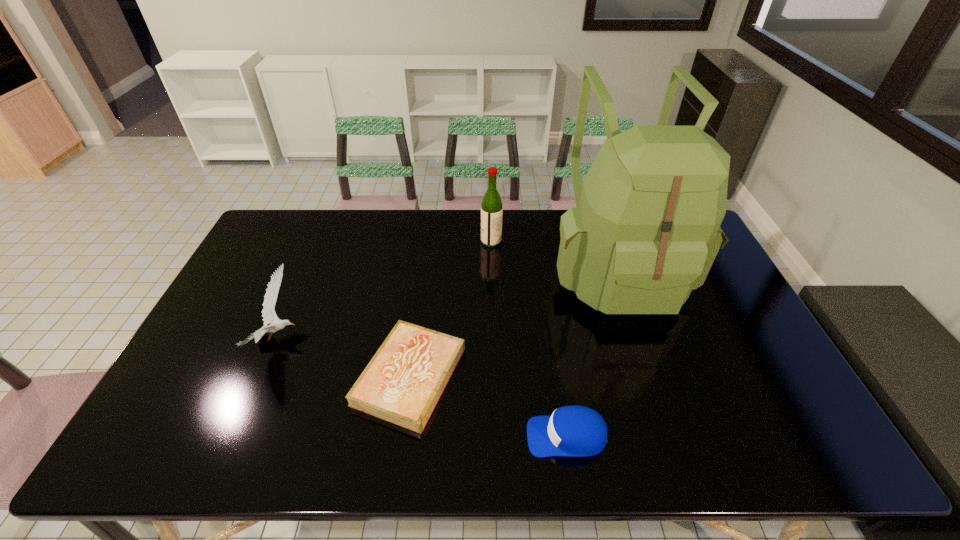
Identify the location of free region located 0.380m on the label of the liquor. The width and height of the screenshot is (960, 540). (374, 241).

Where is `free space located 0.330m on the label of the liquor`? Image resolution: width=960 pixels, height=540 pixels. free space located 0.330m on the label of the liquor is located at coordinates (389, 241).

The width and height of the screenshot is (960, 540). What are the coordinates of `free space located at the tip of the beak of the leftmost object` in the screenshot? It's located at (357, 339).

At what (x,y) coordinates should I click in order to perform the action: click on vacant point located on the front-facing side of the second shortest object. Please return your answer as a coordinate pair (x, y). This screenshot has width=960, height=540. Looking at the image, I should click on (387, 436).

You are a GUI agent. You are given a task and a screenshot of the screen. Output one action in this format:
    pyautogui.click(x=<x>, y=<y>)
    Task: Click on the vacant region located on the front-facing side of the second shortest object
    
    Given the screenshot: What is the action you would take?
    pos(361,436)

This screenshot has height=540, width=960. I want to click on blank space located 0.280m on the front-facing side of the second shortest object, so click(x=408, y=436).

Identify the location of vacant space situated on the left of the fourth object from right to left. (318, 376).

The width and height of the screenshot is (960, 540). What are the coordinates of `backpack present at the far edge` in the screenshot? It's located at (645, 232).

At what (x,y) coordinates should I click in order to perform the action: click on liquor that is at the far edge. Please return your answer as a coordinate pair (x, y). This screenshot has width=960, height=540. Looking at the image, I should click on (491, 206).

Locate an element on the screen. baseball cap located at the near edge is located at coordinates (575, 431).